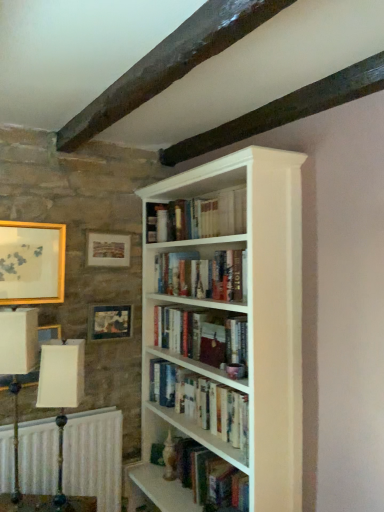
You are a GUI agent. You are given a task and a screenshot of the screen. Output one action in this format:
    pyautogui.click(x=<x>, y=<y>)
    Task: Click on the empty space that is ontop of white textured radiator at lower left
    Image resolution: width=384 pixels, height=512 pixels.
    Given the screenshot: What is the action you would take?
    pyautogui.click(x=49, y=417)